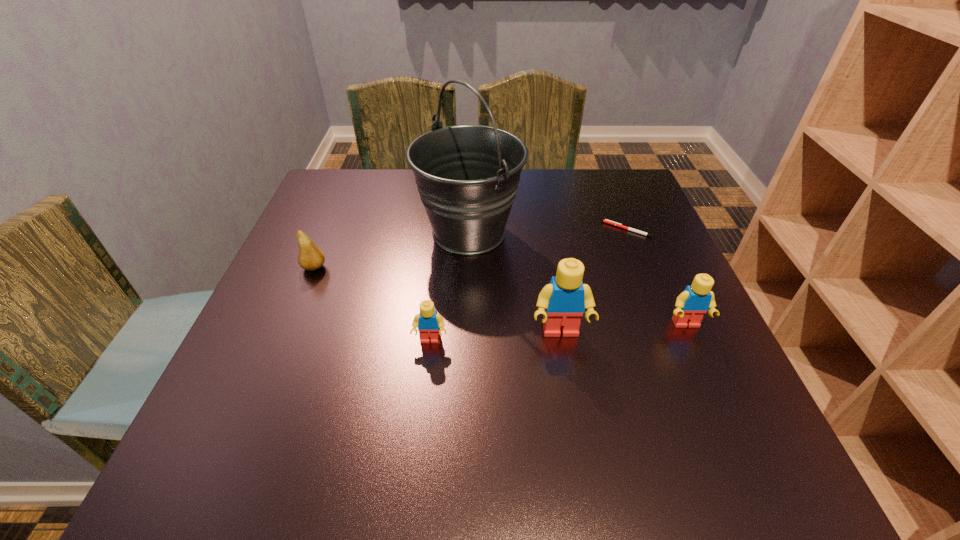
Locate which Lego ranks second in proximity to the fifth shortest object. Please provide its 2D coordinates. Your answer should be formatted as a tuple, i.e. [(x, y)], where the tuple contains the x and y coordinates of a point satisfying the conditions above.

[(428, 322)]

You are a GUI agent. You are given a task and a screenshot of the screen. Output one action in this format:
    pyautogui.click(x=<x>, y=<y>)
    Task: Click on the vacant region that satisfies the following two spatial constraints: 1. on the clicker of the shortest object; 2. on the front-facing side of the second tallest object
    The width and height of the screenshot is (960, 540).
    Given the screenshot: What is the action you would take?
    pyautogui.click(x=669, y=333)